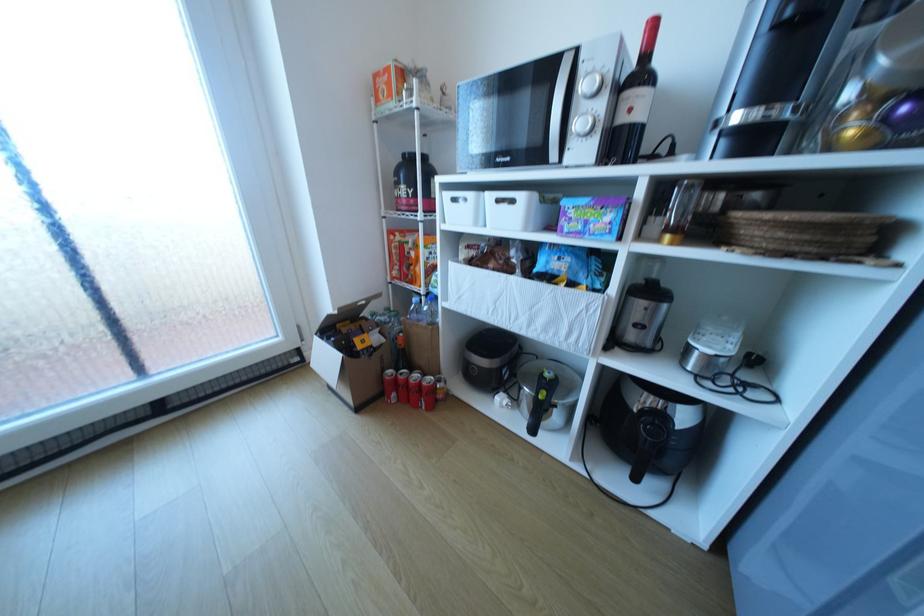
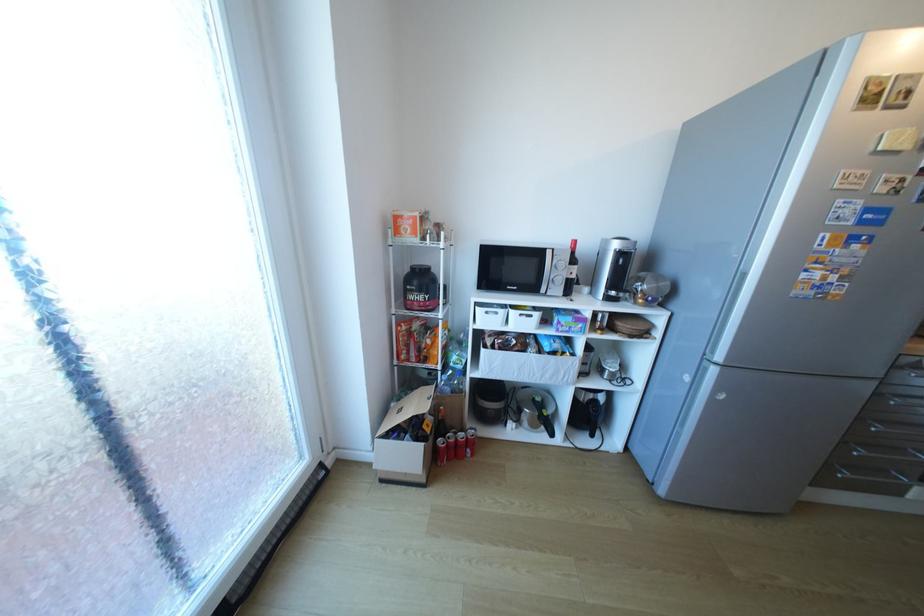
Locate, in the second image, the point that corresponds to the point at 336,339 in the first image.

(407, 437)